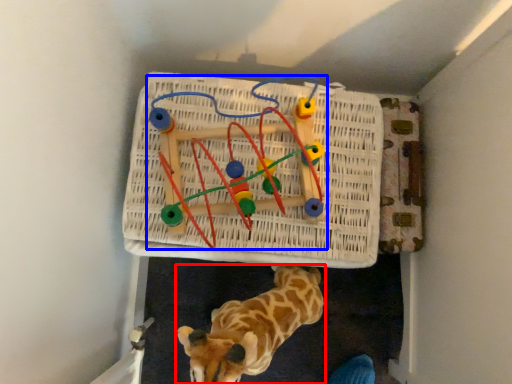
Question: Which object is closer to the camera taking this photo, giraffe (highlighted by a red box) or toy (highlighted by a blue box)?

Choices:
 (A) giraffe
 (B) toy

Answer: (A)